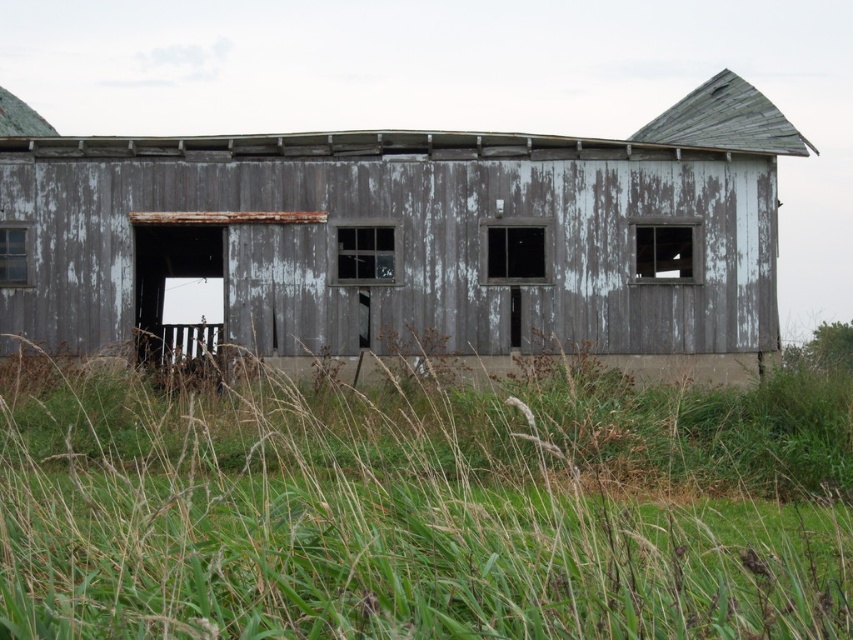
You are standing in front of the old barn and want to place a 3.5 meter long ladder on the ground. Can the green grass at lower center accommodate the ladder without it extending beyond the grass area?

The green grass at lower center is 3.26 meters away from the camera. Since the ladder is 3.5 meters long, it would extend beyond the grass area.

You are standing in the middle of a grassy field and see the green grass at lower center and the weathered gray wood barn at center. Which object is closer to you?

The green grass at lower center is closer to the viewer than the weathered gray wood barn at center.

You are standing in a field and see the green grass at lower center and the weathered gray wood barn at center. Which object is closer to you?

The green grass at lower center is closer to you because it is positioned under the weathered gray wood barn at center, indicating it is in the foreground.